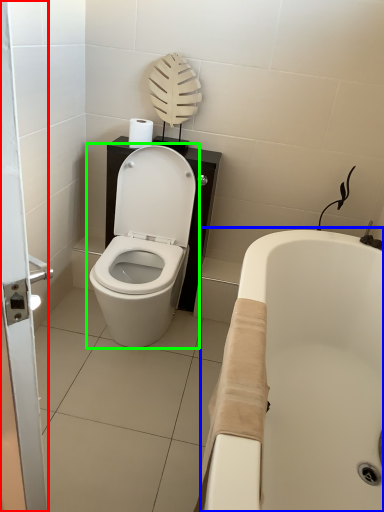
Question: Based on their relative distances, which object is nearer to screen door (highlighted by a red box)? Choose from bath (highlighted by a blue box) and toilet (highlighted by a green box).

Choices:
 (A) bath
 (B) toilet

Answer: (A)